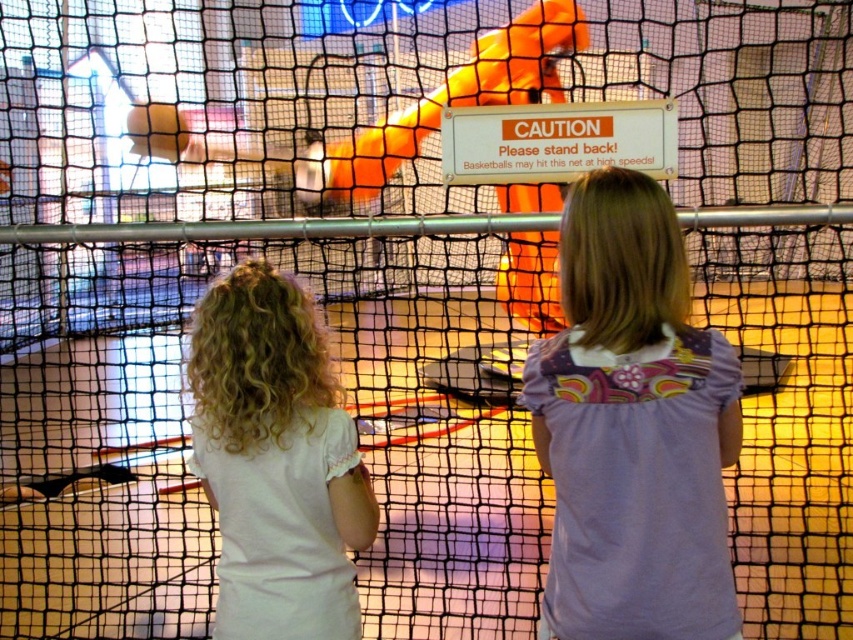
You are a coach observing the two children in the indoor sports facility. You notice both the purple floral shirt at center and the white cotton shirt at center. Which child is closer to the safety net?

The purple floral shirt at center is in front of the white cotton shirt at center, so the child wearing the purple floral shirt at center is closer to the safety net.

You are a safety inspector checking the indoor sports facility. You notice a point labeled at coordinates (633, 428). What object is located at this point?

The point at coordinates (633, 428) corresponds to the purple floral shirt at center.

Consider the image. You are a photographer trying to capture a clear shot of the purple floral shirt at center. Where should you position your camera to ensure the subject is in focus?

The purple floral shirt at center is located at point (633, 428), so you should position your camera to focus on that coordinate to capture the subject clearly.